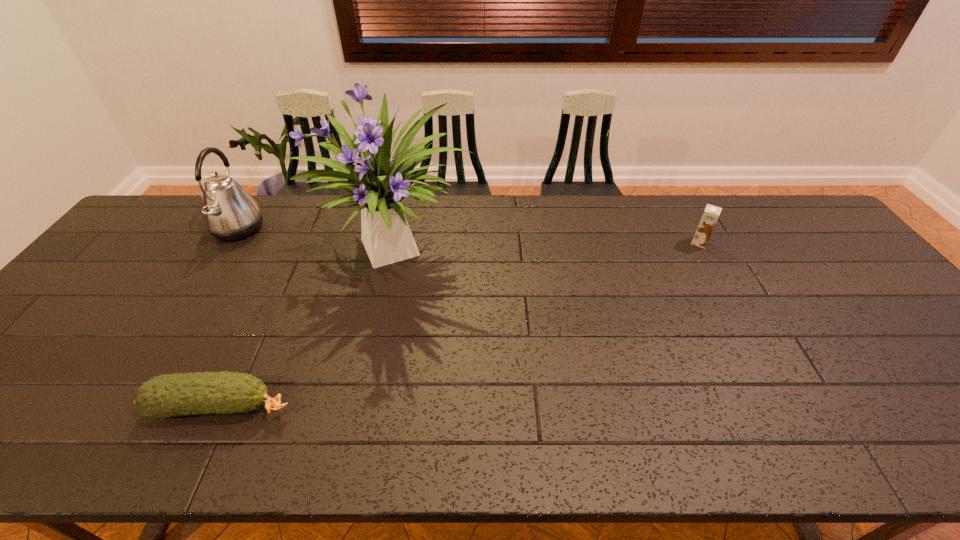
Where is `flower arrangement at the far edge`? flower arrangement at the far edge is located at coordinates (380, 184).

This screenshot has height=540, width=960. In order to click on kettle positioned at the far edge in this screenshot , I will do `click(229, 212)`.

Locate an element on the screen. chocolate milk at the far edge is located at coordinates (710, 216).

Where is `object present at the near edge`? This screenshot has width=960, height=540. object present at the near edge is located at coordinates (176, 394).

In the image, there is a desktop. In order to click on vacant space at the far edge in this screenshot , I will do `click(444, 206)`.

Find the location of a particular element. free space at the near edge is located at coordinates (618, 458).

In the image, there is a desktop. Identify the location of vacant space at the left edge. The image size is (960, 540). (35, 345).

In the image, there is a desktop. In order to click on free space at the right edge in this screenshot , I will do `click(917, 372)`.

The height and width of the screenshot is (540, 960). Identify the location of vacant space that is in between the flower arrangement and the chocolate milk. (549, 247).

Identify the location of vacant area that lies between the third shortest object and the second shortest object. (468, 236).